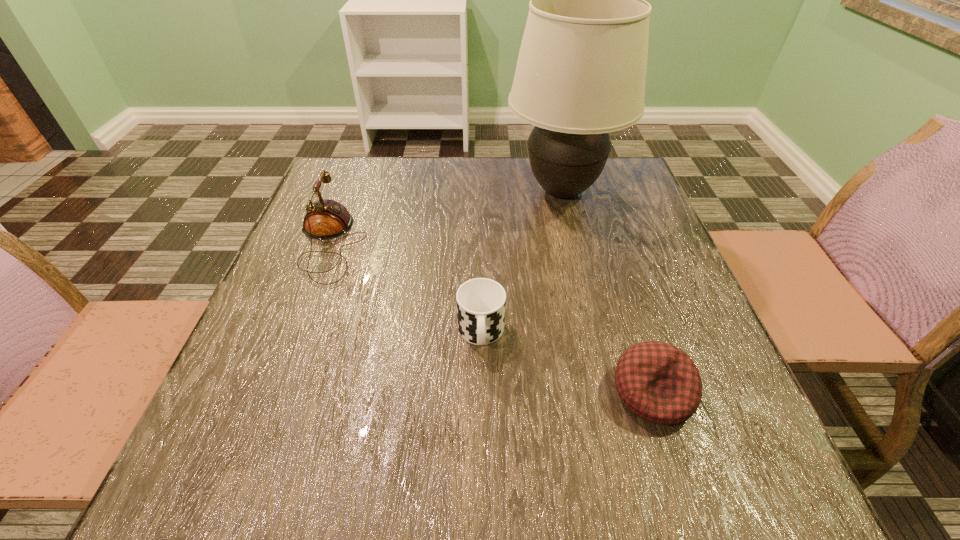
The height and width of the screenshot is (540, 960). Identify the location of the tallest object. (581, 71).

Locate an element on the screen. This screenshot has width=960, height=540. telephone is located at coordinates (325, 219).

This screenshot has width=960, height=540. I want to click on the leftmost object, so click(325, 219).

Identify the location of cup. The height and width of the screenshot is (540, 960). (481, 302).

At what (x,y) coordinates should I click in order to perform the action: click on beanbag. Please return your answer as a coordinate pair (x, y). Looking at the image, I should click on (658, 382).

Locate an element on the screen. vacant space situated 0.370m on the front of the tallest object is located at coordinates (601, 352).

Find the location of a particular element. The height and width of the screenshot is (540, 960). free space located on the rotary dial of the telephone is located at coordinates (495, 242).

This screenshot has width=960, height=540. Identify the location of free space located on the side of the cup with the handle. (481, 503).

I want to click on vacant space located 0.090m on the front of the beanbag, so click(684, 491).

I want to click on object that is positioned at the far edge, so click(x=581, y=71).